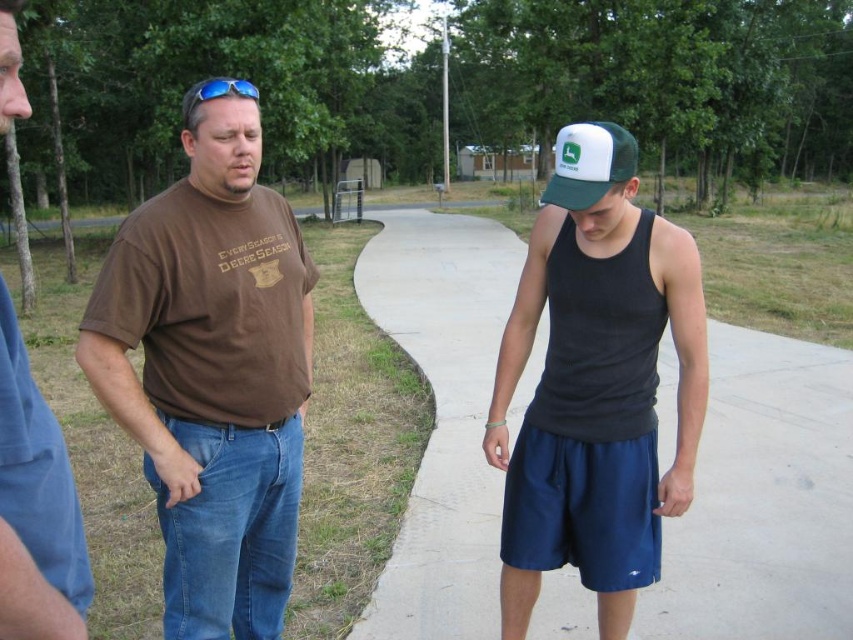
Consider the image. Does black matte tank top at center have a greater width compared to brown cotton t-shirt at left?

Indeed, black matte tank top at center has a greater width compared to brown cotton t-shirt at left.

Who is more forward, (531, 604) or (70, 492)?

Point (70, 492) is more forward.

What do you see at coordinates (595, 385) in the screenshot? This screenshot has width=853, height=640. I see `black matte tank top at center` at bounding box center [595, 385].

At what (x,y) coordinates should I click in order to perform the action: click on black matte tank top at center. Please return your answer as a coordinate pair (x, y). Looking at the image, I should click on (595, 385).

Who is positioned more to the right, smooth concrete sidewalk at center or brown cotton t-shirt at center?

Positioned to the right is smooth concrete sidewalk at center.

Between smooth concrete sidewalk at center and brown cotton t-shirt at center, which one is positioned higher?

Positioned higher is smooth concrete sidewalk at center.

The height and width of the screenshot is (640, 853). What are the coordinates of `smooth concrete sidewalk at center` in the screenshot? It's located at (763, 500).

Who is more distant from viewer, (160, 364) or (630, 177)?

Positioned behind is point (160, 364).

Does point (231, 100) lie in front of point (596, 152)?

No.

Where is `brown cotton t-shirt at center`? This screenshot has height=640, width=853. brown cotton t-shirt at center is located at coordinates (212, 369).

Identify the location of brown cotton t-shirt at center. (212, 369).